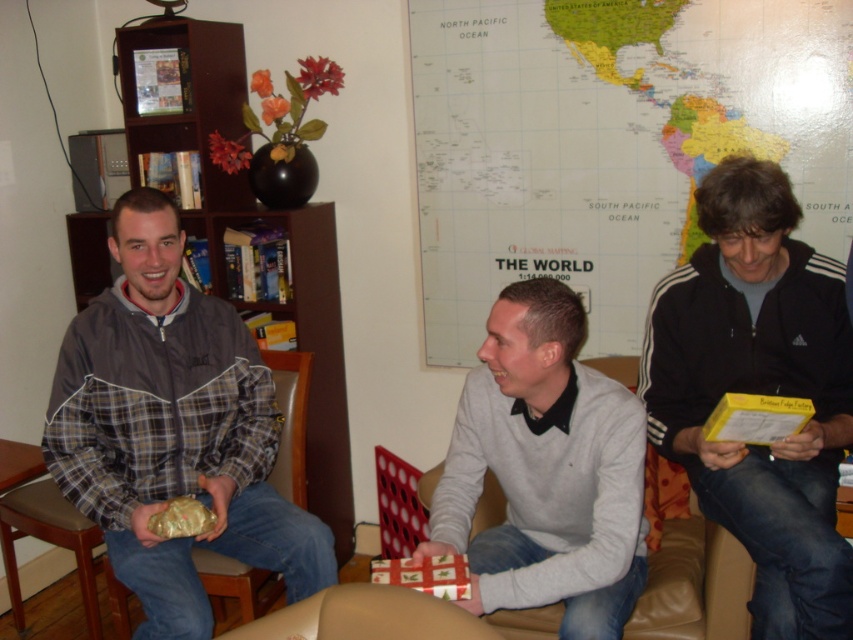
Does light gray sweater at center appear under brown wood bookshelf at left?

Indeed, light gray sweater at center is positioned under brown wood bookshelf at left.

What do you see at coordinates (544, 470) in the screenshot? This screenshot has width=853, height=640. I see `light gray sweater at center` at bounding box center [544, 470].

The width and height of the screenshot is (853, 640). I want to click on light gray sweater at center, so click(x=544, y=470).

Who is taller, plaid fabric jacket at center or brown leather armchair at lower left?

With more height is plaid fabric jacket at center.

Is point (117, 417) positioned before point (280, 435)?

Yes, it is in front of point (280, 435).

Locate an element on the screen. plaid fabric jacket at center is located at coordinates (172, 429).

You are a GUI agent. You are given a task and a screenshot of the screen. Output one action in this format:
    pyautogui.click(x=<x>, y=<y>)
    Task: Click on the plaid fabric jacket at center
    
    Given the screenshot: What is the action you would take?
    pyautogui.click(x=172, y=429)

Who is higher up, world map at center or light gray sweater at center?

world map at center is higher up.

Is point (457, 268) closer to viewer compared to point (550, 506)?

No, it is behind (550, 506).

Where is `world map at center`? The image size is (853, 640). world map at center is located at coordinates (610, 141).

I want to click on world map at center, so click(x=610, y=141).